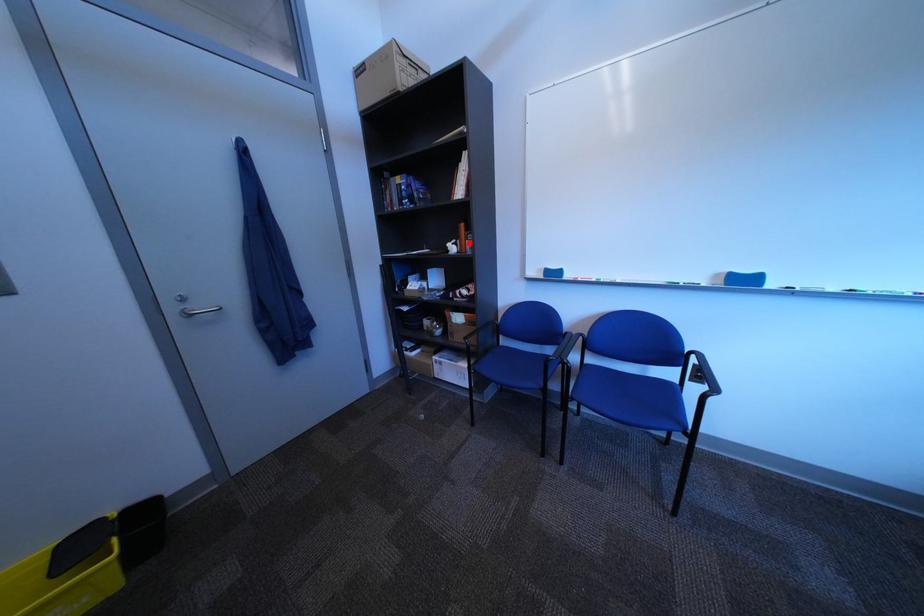
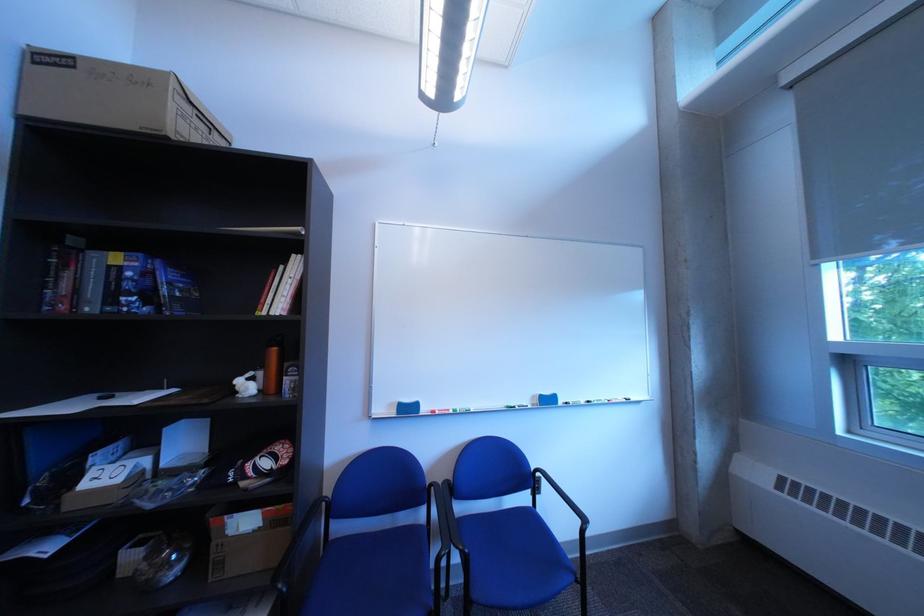
Where in the second image is the point corresponding to the highlighted location from the first image?

(264, 376)